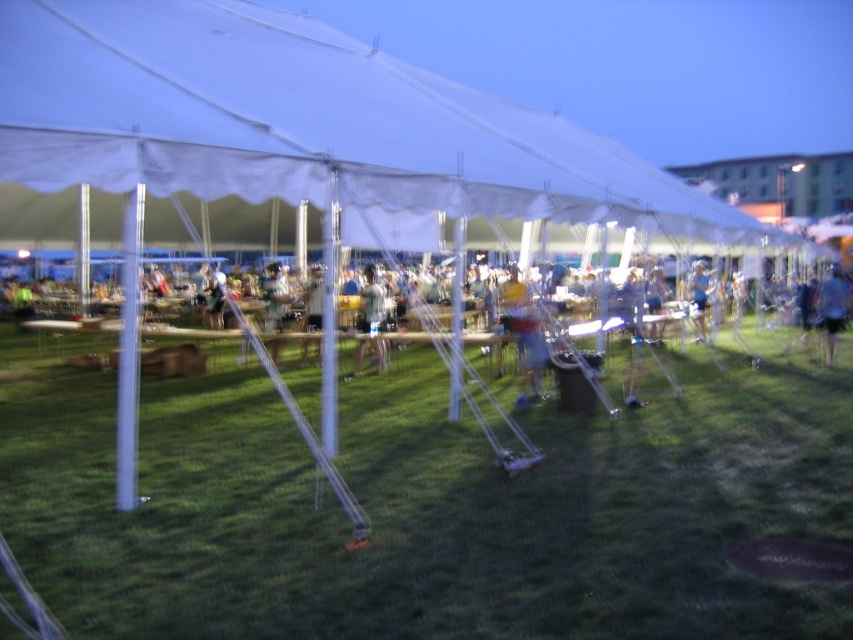
Who is taller, blue fabric shorts at lower right or blue fabric shirt at right?

Standing taller between the two is blue fabric shorts at lower right.

Is blue fabric shorts at lower right closer to the viewer compared to blue fabric shirt at right?

Yes, it is.

Identify the location of blue fabric shorts at lower right. The width and height of the screenshot is (853, 640). (833, 307).

Find the location of a particular element. The image size is (853, 640). blue fabric shorts at lower right is located at coordinates (833, 307).

Looking at this image, which is more to the left, light blue denim shorts at center or blue fabric shirt at right?

light blue denim shorts at center

Is point (376, 369) positioned in front of point (695, 308)?

That is True.

The height and width of the screenshot is (640, 853). In order to click on light blue denim shorts at center in this screenshot , I will do `click(370, 321)`.

Does white fabric canopy at upper center appear on the right side of blue fabric shorts at lower right?

No, white fabric canopy at upper center is not to the right of blue fabric shorts at lower right.

Who is taller, white fabric canopy at upper center or blue fabric shorts at lower right?

white fabric canopy at upper center is taller.

Which is in front, point (509, 196) or point (846, 285)?

Point (509, 196) is more forward.

The width and height of the screenshot is (853, 640). I want to click on white fabric canopy at upper center, so click(x=302, y=122).